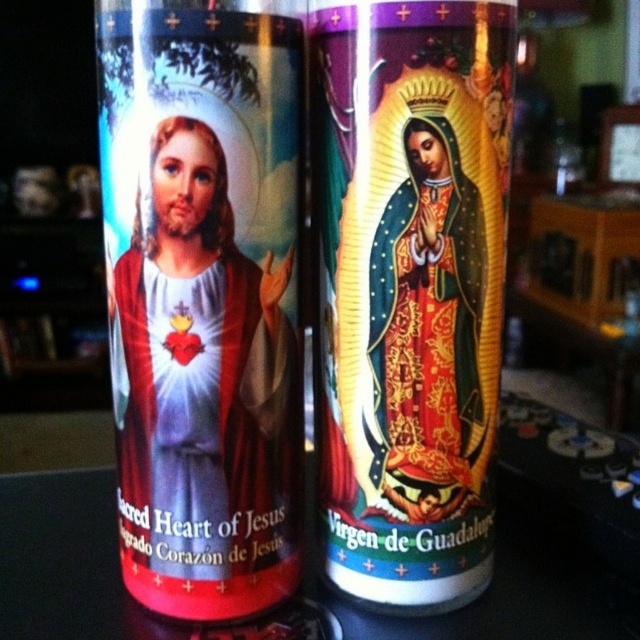
You are standing in front of two candles on a table. You need to light the candle that is closer to you. Which one should you choose between the matte red candle at left and the matte gold virgin of guadalupe at center?

The matte red candle at left is closer to the viewer than the matte gold virgin of guadalupe at center, so you should light the matte red candle at left.

You are a decorator arranging candles on a table. You have a matte red candle at left and a matte gold virgin of guadalupe at center. Which candle is taller?

The matte gold virgin of guadalupe at center is taller than the matte red candle at left.

You are standing 30 inches away from a table with two religious candles. The point on the table labeled as point (282, 410) is where you want to place a new candle. Can you reach that point without moving closer to the table?

The distance of point (282, 410) from viewer is 31.16 inches, so you are currently 30 inches away from the table. Therefore, the point is 1.16 inches beyond your current reach. You need to move 1.16 inches closer to the table to place the candle at that point.